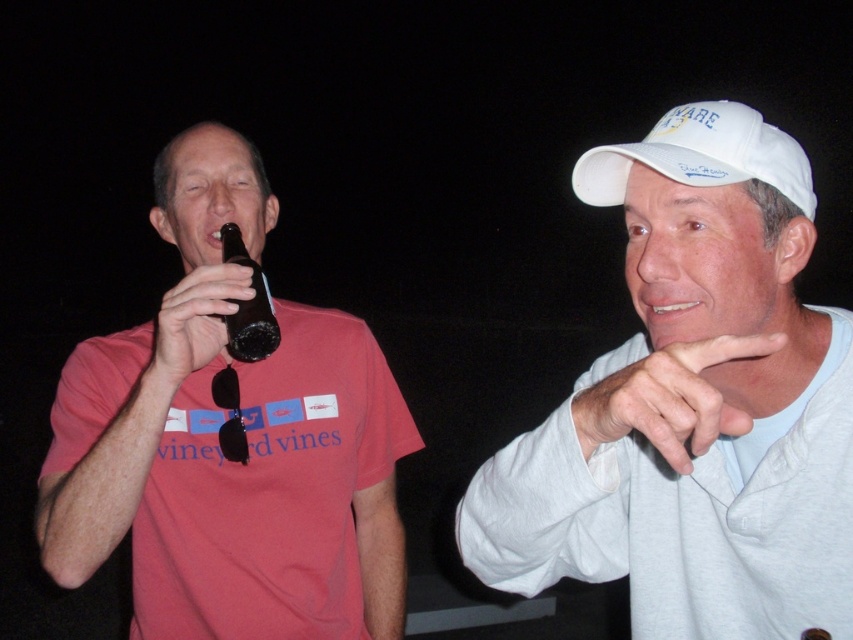
You are a photographer setting up a shot of two people. You need to position a spotlight so it illuminates both the matte black beer bottle at left and the white fabric baseball cap at upper right. Since the beer bottle is matte black, it might not reflect light well. Where should you place the spotlight to ensure both objects are properly lit?

Place the spotlight to the right of the white fabric baseball cap at upper right. This way, light will hit the matte black beer bottle at left directly and also reach the cap, ensuring both are illuminated effectively.

You are a photographer trying to capture a candid shot of the two people in the scene. If you want to focus on the white fabric baseball cap at upper right without the dark brown glass bottle at left blocking it, which direction should you move your camera slightly?

You should move your camera slightly to the right to position the white fabric baseball cap at upper right in front of the dark brown glass bottle at left, as the cap is already in front of the bottle and moving right would ensure it remains unobstructed.